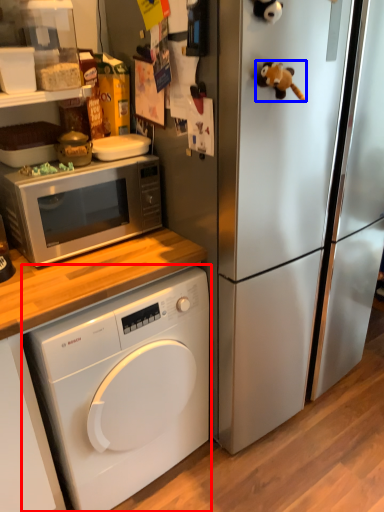
Question: Among these objects, which one is farthest to the camera, washing machine (highlighted by a red box) or toy (highlighted by a blue box)?

Choices:
 (A) washing machine
 (B) toy

Answer: (A)